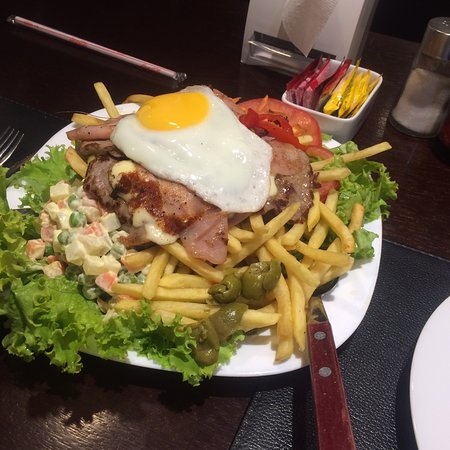
Find the location of `small white square bowl`. small white square bowl is located at coordinates (334, 127).